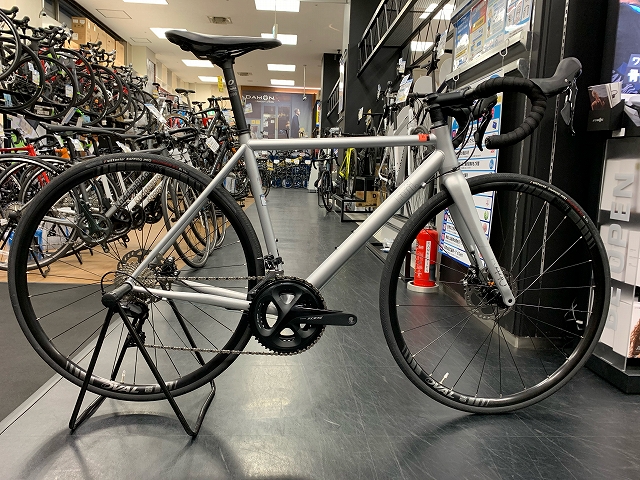
This screenshot has width=640, height=480. I want to click on floor, so click(342, 428).